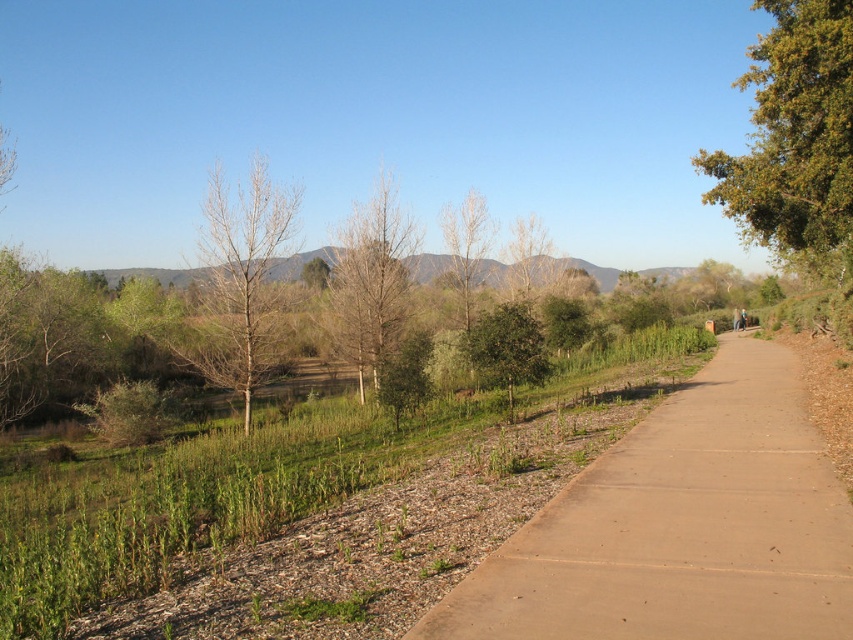
Between point (366, 346) and point (527, 326), which one is positioned behind?

The point (366, 346) is more distant.

Can you confirm if brown matte tree at center is thinner than green leafy tree at center?

In fact, brown matte tree at center might be wider than green leafy tree at center.

The width and height of the screenshot is (853, 640). I want to click on brown matte tree at center, so click(370, 280).

The height and width of the screenshot is (640, 853). I want to click on brown matte tree at center, so 370,280.

Find the location of a particular element. bare wood tree at center is located at coordinates (241, 280).

Can you confirm if bare wood tree at center is bigger than brown matte tree at center?

Yes.

Identify the location of bare wood tree at center. The height and width of the screenshot is (640, 853). (241, 280).

Where is `bare wood tree at center`? This screenshot has height=640, width=853. bare wood tree at center is located at coordinates (241, 280).

Is brown concrete path at center closer to the viewer compared to bare wood tree at center?

Yes, brown concrete path at center is in front of bare wood tree at center.

The image size is (853, 640). I want to click on brown concrete path at center, so click(682, 525).

Between point (608, 573) and point (247, 358), which one is positioned in front?

Point (608, 573) is more forward.

Locate an element on the screen. brown concrete path at center is located at coordinates (682, 525).